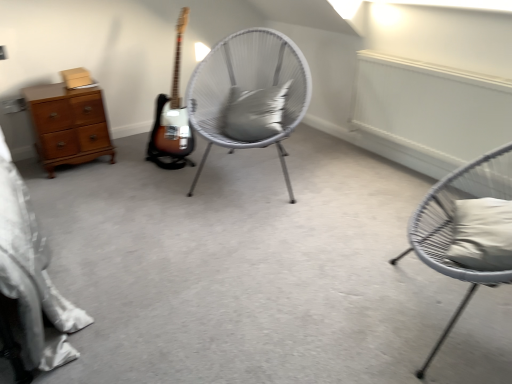
Question: Is white wicker chair at center, which is the 1th chair from back to front, oriented towards wooden chest of drawers at left?

Choices:
 (A) yes
 (B) no

Answer: (B)

Question: Is white wicker chair at center, which ranks as the first chair in left-to-right order, next to wooden chest of drawers at left and touching it?

Choices:
 (A) no
 (B) yes

Answer: (A)

Question: Is white wicker chair at center, the second chair from the right, outside of wooden chest of drawers at left?

Choices:
 (A) yes
 (B) no

Answer: (A)

Question: Considering the relative sizes of white wicker chair at center, the second chair from the right, and wooden chest of drawers at left in the image provided, is white wicker chair at center, the second chair from the right, taller than wooden chest of drawers at left?

Choices:
 (A) no
 (B) yes

Answer: (B)

Question: From a real-world perspective, is white wicker chair at center, the second chair from the right, over wooden chest of drawers at left?

Choices:
 (A) no
 (B) yes

Answer: (B)

Question: Considering the relative positions of white wicker chair at center, which is the 1th chair from back to front, and wooden chest of drawers at left in the image provided, is white wicker chair at center, which is the 1th chair from back to front, to the left of wooden chest of drawers at left from the viewer's perspective?

Choices:
 (A) no
 (B) yes

Answer: (A)

Question: Is wooden chest of drawers at left not inside gray matte pillow at center, which is the 1th pillow from left to right?

Choices:
 (A) no
 (B) yes

Answer: (B)

Question: Is wooden chest of drawers at left wider than gray matte pillow at center, positioned as the second pillow in right-to-left order?

Choices:
 (A) yes
 (B) no

Answer: (A)

Question: From the image's perspective, would you say wooden chest of drawers at left is shown under gray matte pillow at center, which is counted as the 1th pillow, starting from the top?

Choices:
 (A) no
 (B) yes

Answer: (B)

Question: Does wooden chest of drawers at left have a greater height compared to gray matte pillow at center, which is counted as the second pillow, starting from the bottom?

Choices:
 (A) no
 (B) yes

Answer: (B)

Question: Is wooden chest of drawers at left at the right side of gray matte pillow at center, arranged as the 1th pillow when viewed from the back?

Choices:
 (A) yes
 (B) no

Answer: (B)

Question: Considering the relative sizes of wooden chest of drawers at left and gray matte pillow at center, arranged as the 1th pillow when viewed from the back, in the image provided, is wooden chest of drawers at left bigger than gray matte pillow at center, arranged as the 1th pillow when viewed from the back,?

Choices:
 (A) no
 (B) yes

Answer: (B)

Question: Does gray matte pillow at center, arranged as the 1th pillow when viewed from the back, have a lesser height compared to matte gray chair at right, the 1th chair viewed from the front?

Choices:
 (A) yes
 (B) no

Answer: (A)